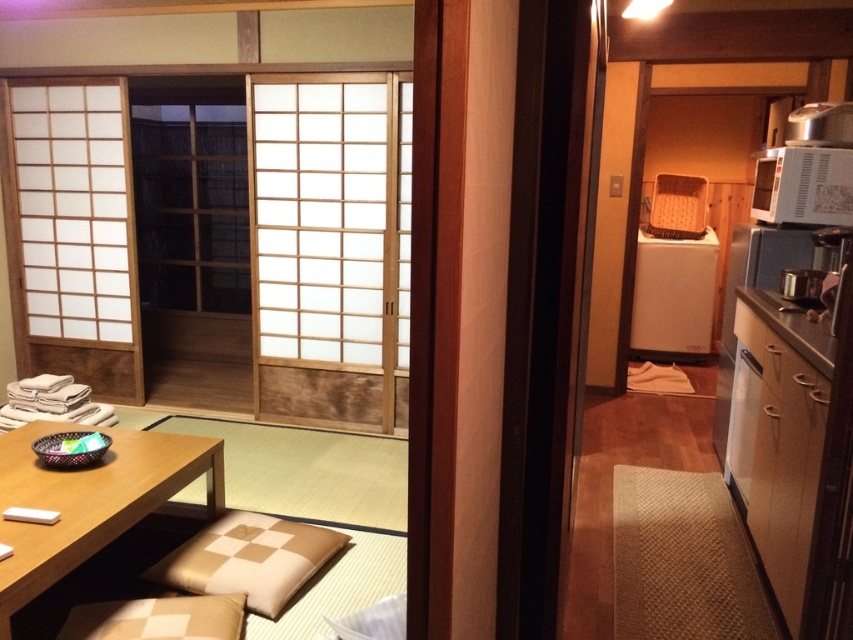
Which is below, wooden table at center or white matte microwave at upper right?

wooden table at center is lower down.

Can you confirm if wooden table at center is positioned below white matte microwave at upper right?

Yes, wooden table at center is below white matte microwave at upper right.

Identify the location of wooden table at center. (90, 500).

Can you confirm if wooden table at center is smaller than beige checkered pillow at lower center?

No.

Who is more forward, (x=170, y=465) or (x=228, y=589)?

Point (x=228, y=589)

The image size is (853, 640). I want to click on wooden table at center, so click(90, 500).

Looking at this image, between beige checkered pillow at lower center and white matte microwave at upper right, which one is positioned lower?

Positioned lower is beige checkered pillow at lower center.

Is point (267, 577) positioned after point (817, 182)?

No, (267, 577) is in front of (817, 182).

Who is more distant from viewer, (x=288, y=566) or (x=840, y=212)?

Point (x=840, y=212)

This screenshot has width=853, height=640. I want to click on beige checkered pillow at lower center, so click(x=248, y=560).